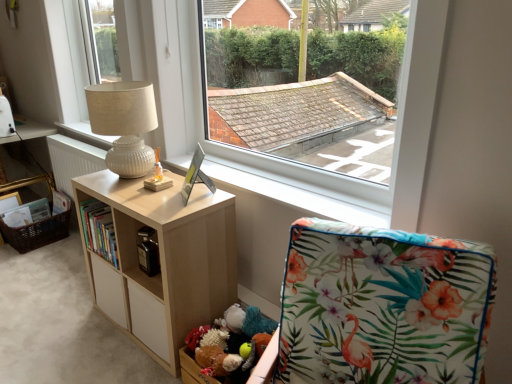
Where is `blank space above white wooden window sill at center (from a real-world perspective)`? blank space above white wooden window sill at center (from a real-world perspective) is located at coordinates (285, 188).